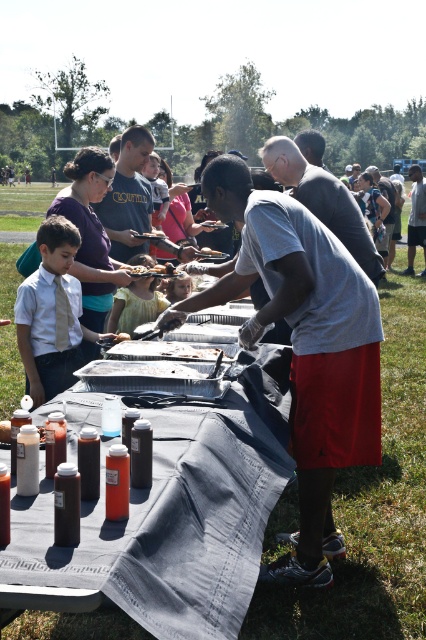
Which of these two, white plastic tray at center or brown paper bag at center, stands taller?

brown paper bag at center is taller.

Does white plastic tray at center appear over brown paper bag at center?

Incorrect, white plastic tray at center is not positioned above brown paper bag at center.

The width and height of the screenshot is (426, 640). Identify the location of white plastic tray at center. (141, 369).

The width and height of the screenshot is (426, 640). I want to click on white plastic tray at center, so click(141, 369).

In the scene shown: Is yellow fabric dress at center to the left of white styrofoam tray at center from the viewer's perspective?

Yes, yellow fabric dress at center is to the left of white styrofoam tray at center.

Is point (150, 304) farther from camera compared to point (166, 348)?

Yes.

This screenshot has width=426, height=640. What are the coordinates of `yellow fabric dress at center` in the screenshot? It's located at (135, 305).

Is matte white shirt at center smaller than white plastic tray at center?

Incorrect, matte white shirt at center is not smaller in size than white plastic tray at center.

Who is higher up, matte white shirt at center or white plastic tray at center?

matte white shirt at center is above.

This screenshot has width=426, height=640. Identify the location of matte white shirt at center. (51, 314).